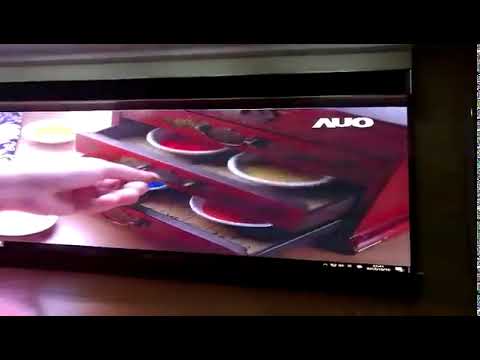
I want to click on wooden tabletop/desk, so click(x=85, y=305).